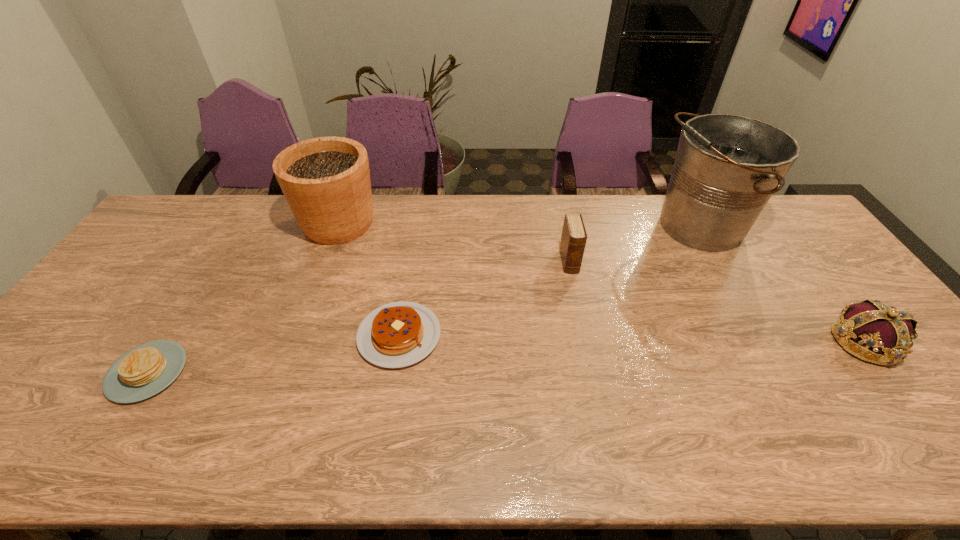
What are the coordinates of `free space located 0.390m on the spine side of the diary` in the screenshot? It's located at (596, 391).

The height and width of the screenshot is (540, 960). Find the location of `vacant area situated on the back of the rightmost object`. vacant area situated on the back of the rightmost object is located at coordinates (795, 251).

Identify the location of vacant space located on the back of the right pancake. This screenshot has height=540, width=960. pyautogui.click(x=408, y=279).

Identify the location of vacant space located on the back of the leftmost object. Image resolution: width=960 pixels, height=540 pixels. point(183,313).

At what (x,y) coordinates should I click in order to perform the action: click on bucket that is at the far edge. Please return your answer as a coordinate pair (x, y). This screenshot has width=960, height=540. Looking at the image, I should click on (727, 166).

Locate an element on the screen. This screenshot has height=540, width=960. flowerpot that is positioned at the far edge is located at coordinates (326, 181).

At what (x,y) coordinates should I click in order to perform the action: click on object that is at the right edge. Please return your answer as a coordinate pair (x, y). This screenshot has height=540, width=960. Looking at the image, I should click on (884, 334).

Where is `free space at the far edge of the desktop`? free space at the far edge of the desktop is located at coordinates (x=285, y=217).

This screenshot has height=540, width=960. Identify the location of blank area at the near edge. (323, 431).

Where is `free space at the left edge`? This screenshot has width=960, height=540. free space at the left edge is located at coordinates (141, 289).